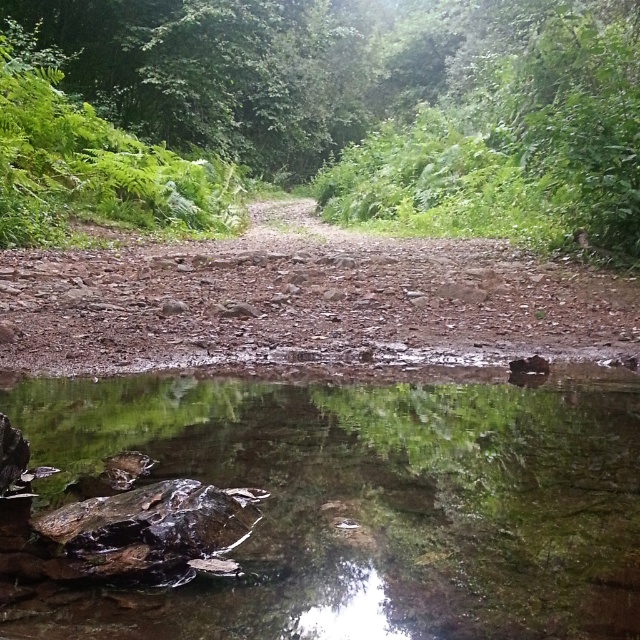
You are standing at the edge of the pond and want to locate the clear water at center. According to the coordinates provided, in which direction should you look relative to your position?

The clear water at center is located at coordinates point (355, 506), so you should look towards the center of the pond to find it.

You are standing at the point with coordinates (376, 93) in the serene natural scene. What object is located exactly at this point?

The green leafy tree at center is located exactly at point (376, 93).

You are standing on the dirt path and want to step onto the clear water at center to retrieve a floating item. Which direction should you move relative to the dull brown gravel at center?

The clear water at center is to the right of the dull brown gravel at center, so you should move to the right relative to the dull brown gravel at center to reach the clear water at center.